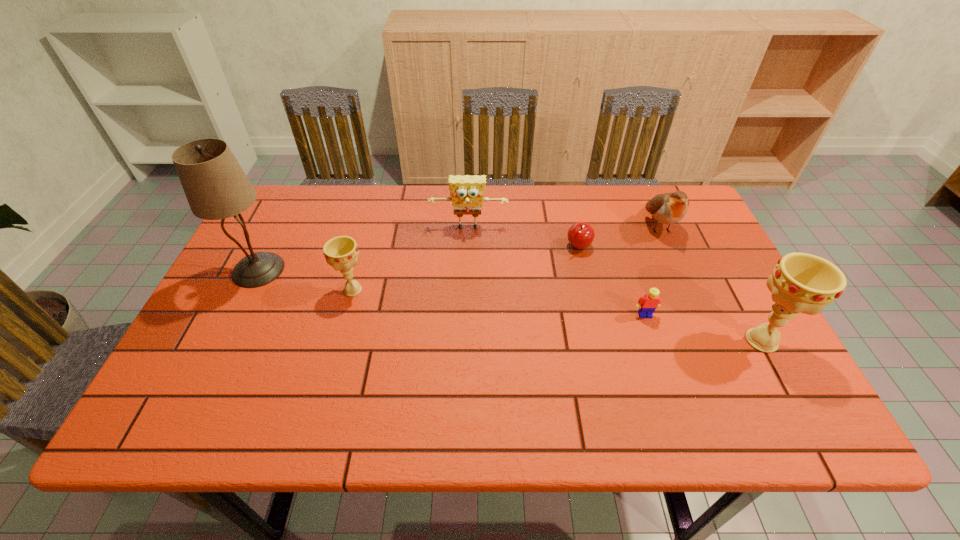
This screenshot has height=540, width=960. What are the coordinates of `object that is at the near edge` in the screenshot? It's located at (800, 282).

At what (x,y) coordinates should I click in order to perform the action: click on object that is at the left edge. Please return your answer as a coordinate pair (x, y). Looking at the image, I should click on (216, 187).

Where is `chalice present at the right edge`? This screenshot has height=540, width=960. chalice present at the right edge is located at coordinates (800, 282).

The height and width of the screenshot is (540, 960). I want to click on bird located in the right edge section of the desktop, so click(x=668, y=208).

The height and width of the screenshot is (540, 960). In order to click on object that is at the far right corner in this screenshot , I will do `click(668, 208)`.

Identify the location of object present at the near right corner. (800, 282).

Identify the location of free space at the far edge of the desktop. (518, 220).

Locate an element on the screen. vacant space at the left edge of the desktop is located at coordinates (252, 302).

Where is `free space at the right edge of the desktop`? The image size is (960, 540). free space at the right edge of the desktop is located at coordinates (682, 242).

Find the location of a particular element. Image resolution: width=960 pixels, height=540 pixels. vacant region at the far left corner of the desktop is located at coordinates (306, 218).